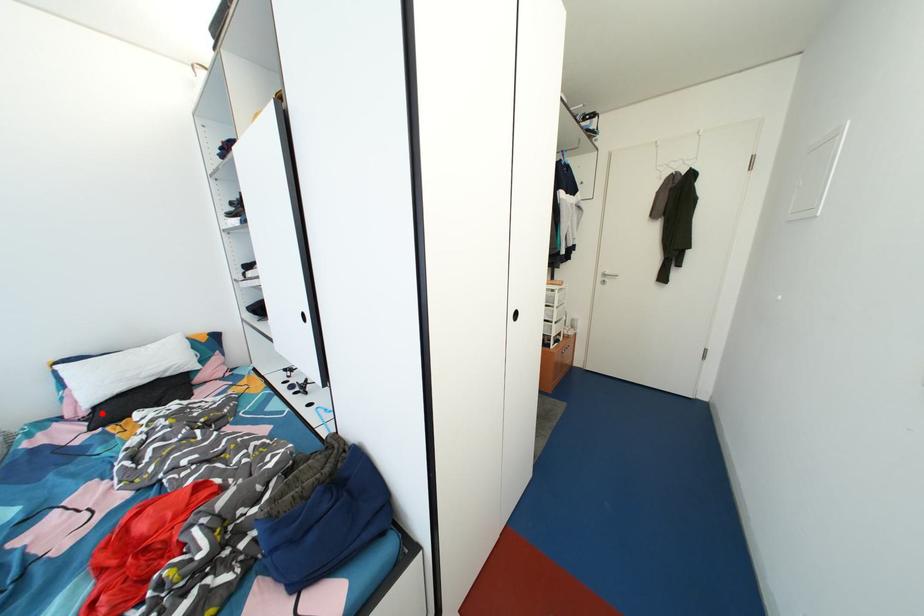
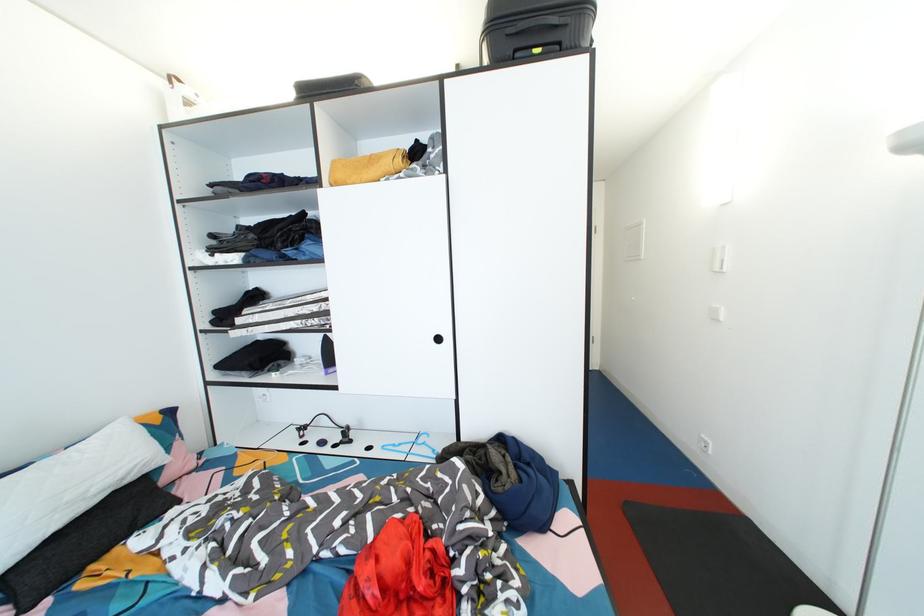
Find the pixel in the second image that matches the highlighted location in the first image.

(8, 583)